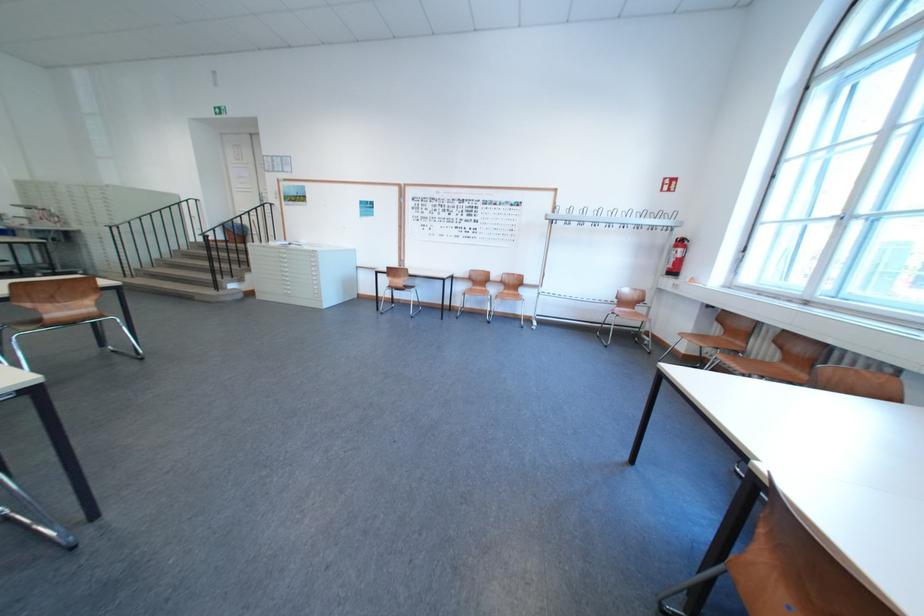
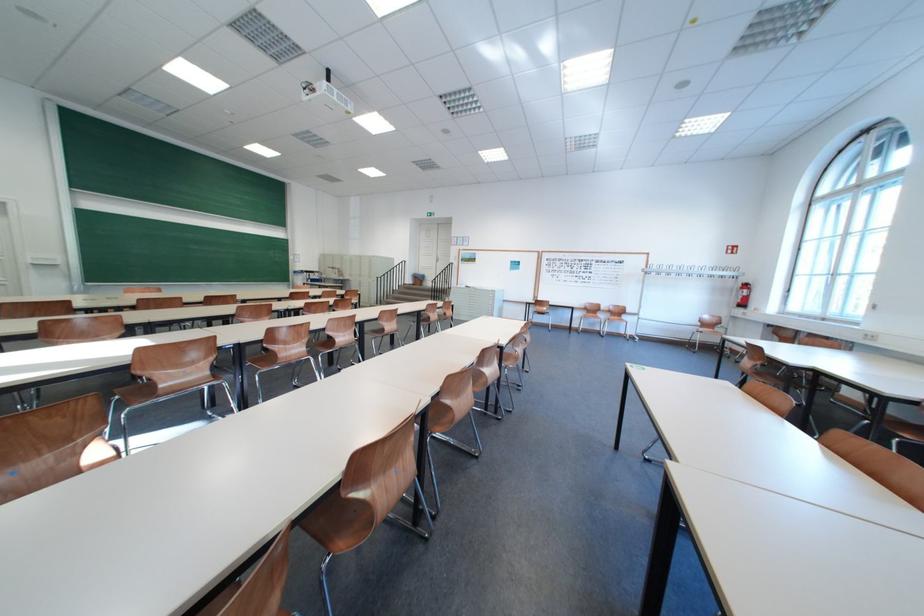
The point at (x=551, y=208) is marked in the first image. Where is the corresponding point in the second image?

(649, 265)